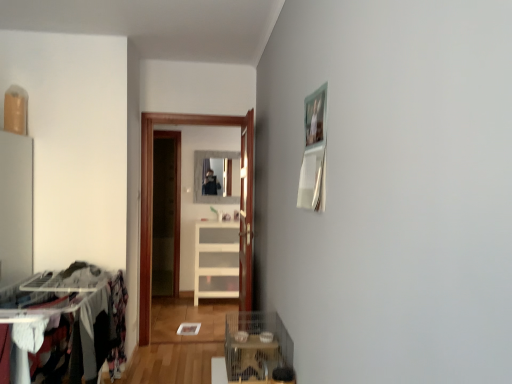
What is the approximate width of metallic wire cage at lower center?

25.63 centimeters.

This screenshot has height=384, width=512. Describe the element at coordinates (152, 191) in the screenshot. I see `transparent glass door at center` at that location.

This screenshot has width=512, height=384. What are the coordinates of `wooden door at center` in the screenshot? It's located at (246, 217).

Which object is thinner, metallic wire cage at lower center or white glossy cabinet at center?

metallic wire cage at lower center.

Considering the sizes of objects metallic wire cage at lower center and white glossy cabinet at center in the image provided, who is taller, metallic wire cage at lower center or white glossy cabinet at center?

Standing taller between the two is white glossy cabinet at center.

You are a GUI agent. You are given a task and a screenshot of the screen. Output one action in this format:
    pyautogui.click(x=<x>, y=<y>)
    Task: Click on the table below the white glossy cabinet at center (from the image's perspective)
    The width and height of the screenshot is (512, 384).
    Given the screenshot: What is the action you would take?
    pyautogui.click(x=251, y=360)

Can you confirm if metallic wire cage at lower center is positioned to the right of white glossy cabinet at center?

Correct, you'll find metallic wire cage at lower center to the right of white glossy cabinet at center.

Can you confirm if transparent glass door at center is wider than white glossy cabinet at center?

Incorrect, the width of transparent glass door at center does not surpass that of white glossy cabinet at center.

From the image's perspective, is transparent glass door at center positioned above or below white glossy cabinet at center?

Based on their image positions, transparent glass door at center is located above white glossy cabinet at center.

Can you confirm if transparent glass door at center is positioned to the left of white glossy cabinet at center?

Correct, you'll find transparent glass door at center to the left of white glossy cabinet at center.

Between white marble mirror at center and metallic wire cage at lower center, which one has larger width?

Wider between the two is metallic wire cage at lower center.

Based on their sizes in the image, would you say white marble mirror at center is bigger or smaller than metallic wire cage at lower center?

In the image, white marble mirror at center appears to be larger than metallic wire cage at lower center.

Measure the distance between white marble mirror at center and metallic wire cage at lower center.

11.34 feet.

Would you say white marble mirror at center contains wooden door at center?

That's incorrect, wooden door at center is not inside white marble mirror at center.

Who is taller, white marble mirror at center or wooden door at center?

Standing taller between the two is wooden door at center.

What are the coordinates of `mirror above the wooden door at center (from the image's perspective)` in the screenshot? It's located at (201, 177).

From a real-world perspective, which is physically below, white marble mirror at center or wooden door at center?

From a 3D spatial view, wooden door at center is below.

What's the angular difference between metallic wire cage at lower center and wooden door at center's facing directions?

The angular difference between metallic wire cage at lower center and wooden door at center is 1.28 degrees.

Is metallic wire cage at lower center surrounding wooden door at center?

No, wooden door at center is located outside of metallic wire cage at lower center.

Identify the location of table that appears in front of the wooden door at center. (251, 360).

Does point (249, 167) appear closer or farther from the camera than point (201, 256)?

Point (249, 167) is closer to the camera than point (201, 256).

Based on their sizes in the image, would you say wooden door at center is bigger or smaller than white glossy cabinet at center?

wooden door at center is smaller than white glossy cabinet at center.

How many degrees apart are the facing directions of wooden door at center and white glossy cabinet at center?

The facing directions of wooden door at center and white glossy cabinet at center are 88.7 degrees apart.

The image size is (512, 384). I want to click on cabinetry behind the wooden door at center, so click(x=216, y=260).

Which of these two, white glossy cabinet at center or white marble mirror at center, is bigger?

With larger size is white glossy cabinet at center.

From their relative heights in the image, would you say white glossy cabinet at center is taller or shorter than white marble mirror at center?

Clearly, white glossy cabinet at center is taller compared to white marble mirror at center.

Locate an element on the screen. The width and height of the screenshot is (512, 384). cabinetry on the right of white marble mirror at center is located at coordinates (216, 260).

Is white glossy cabinet at center positioned with its back to white marble mirror at center?

No, white marble mirror at center is not at the back of white glossy cabinet at center.

Image resolution: width=512 pixels, height=384 pixels. Find the location of `table lying below the white glossy cabinet at center (from the image's perspective)`. table lying below the white glossy cabinet at center (from the image's perspective) is located at coordinates (251, 360).

This screenshot has width=512, height=384. I want to click on cabinetry on the right side of transparent glass door at center, so click(216, 260).

Consider the image. Estimate the real-world distances between objects in this image. Which object is further from white glossy cabinet at center, white marble mirror at center or metallic wire cage at lower center?

Based on the image, metallic wire cage at lower center appears to be further to white glossy cabinet at center.

Considering their positions, is wooden door at center positioned closer to white marble mirror at center than white glossy cabinet at center?

white glossy cabinet at center is closer to white marble mirror at center.

Which object lies nearer to the anchor point wooden door at center, transparent glass door at center or metallic wire cage at lower center?

metallic wire cage at lower center lies closer to wooden door at center than the other object.

Based on their spatial positions, is white glossy cabinet at center or wooden door at center further from metallic wire cage at lower center?

white glossy cabinet at center is further to metallic wire cage at lower center.

Looking at the image, which one is located closer to white marble mirror at center, wooden door at center or metallic wire cage at lower center?

Based on the image, wooden door at center appears to be nearer to white marble mirror at center.

Looking at the image, which one is located closer to white glossy cabinet at center, metallic wire cage at lower center or transparent glass door at center?

The object closer to white glossy cabinet at center is transparent glass door at center.

From the picture: Estimate the real-world distances between objects in this image. Which object is further from metallic wire cage at lower center, transparent glass door at center or wooden door at center?

transparent glass door at center.

When comparing their distances from white marble mirror at center, does metallic wire cage at lower center or white glossy cabinet at center seem further?

metallic wire cage at lower center.

This screenshot has width=512, height=384. I want to click on cabinetry between wooden door at center and white marble mirror at center from front to back, so click(216, 260).

Find the location of a particular element. This screenshot has height=384, width=512. glass door located between wooden door at center and white marble mirror at center in the depth direction is located at coordinates (152, 191).

The width and height of the screenshot is (512, 384). Find the location of `glass door located between wooden door at center and white glossy cabinet at center in the depth direction`. glass door located between wooden door at center and white glossy cabinet at center in the depth direction is located at coordinates (152, 191).

The height and width of the screenshot is (384, 512). In order to click on glass door located between metallic wire cage at lower center and white marble mirror at center in the depth direction in this screenshot , I will do `click(152, 191)`.